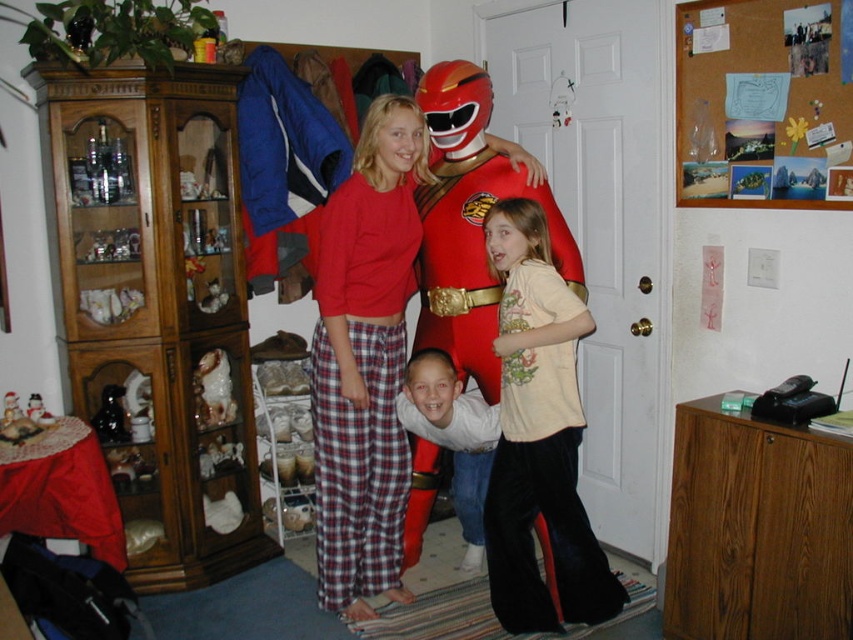
Which is more to the right, light beige cotton shirt at center or smooth white shirt at center?

Positioned to the right is light beige cotton shirt at center.

Can you confirm if light beige cotton shirt at center is positioned to the left of smooth white shirt at center?

No, light beige cotton shirt at center is not to the left of smooth white shirt at center.

Does point (502, 211) come closer to viewer compared to point (491, 424)?

Yes, point (502, 211) is in front of point (491, 424).

Find the location of a particular element. This screenshot has height=640, width=853. light beige cotton shirt at center is located at coordinates (538, 436).

The width and height of the screenshot is (853, 640). In order to click on shiny red costume at center in this screenshot , I will do `click(469, 224)`.

Does shiny red costume at center lie behind red shiny plastic costume at center?

No, shiny red costume at center is in front of red shiny plastic costume at center.

Where is `shiny red costume at center`? This screenshot has height=640, width=853. shiny red costume at center is located at coordinates (469, 224).

From the picture: Does red shiny plastic costume at center appear on the left side of smooth white shirt at center?

In fact, red shiny plastic costume at center is to the right of smooth white shirt at center.

What do you see at coordinates (474, 259) in the screenshot?
I see `red shiny plastic costume at center` at bounding box center [474, 259].

Where is `red shiny plastic costume at center`? This screenshot has width=853, height=640. red shiny plastic costume at center is located at coordinates (474, 259).

I want to click on red shiny plastic costume at center, so click(474, 259).